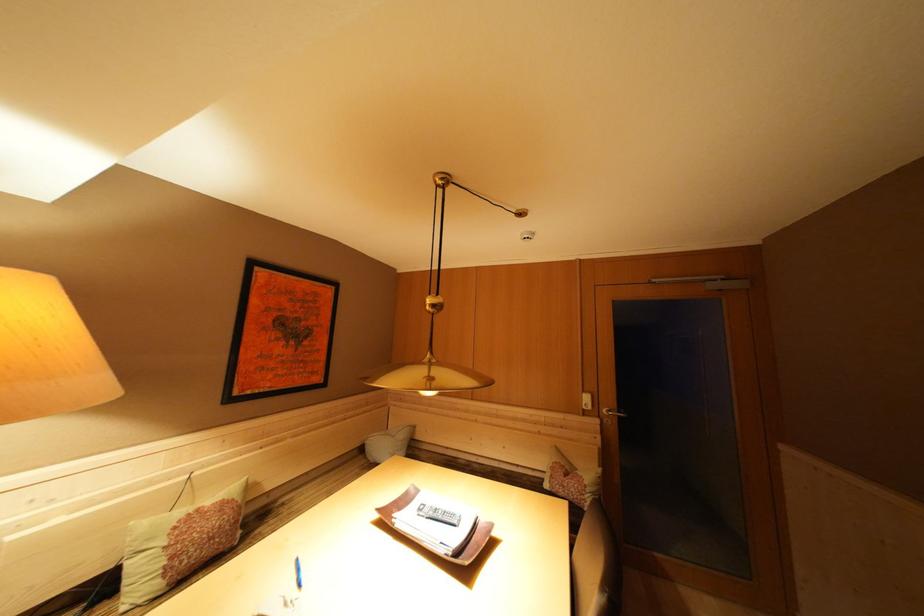
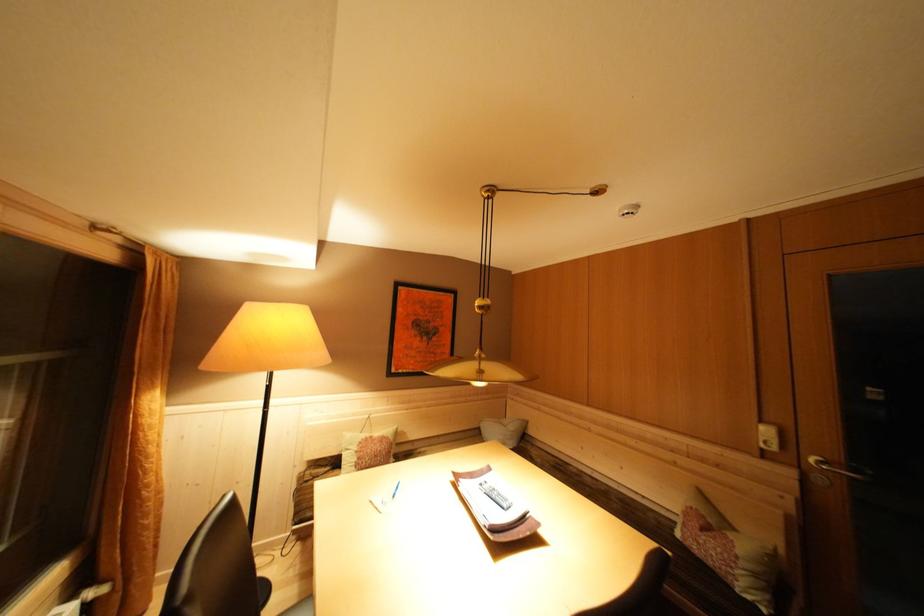
The point at (590, 397) is marked in the first image. Where is the corresponding point in the second image?

(768, 427)